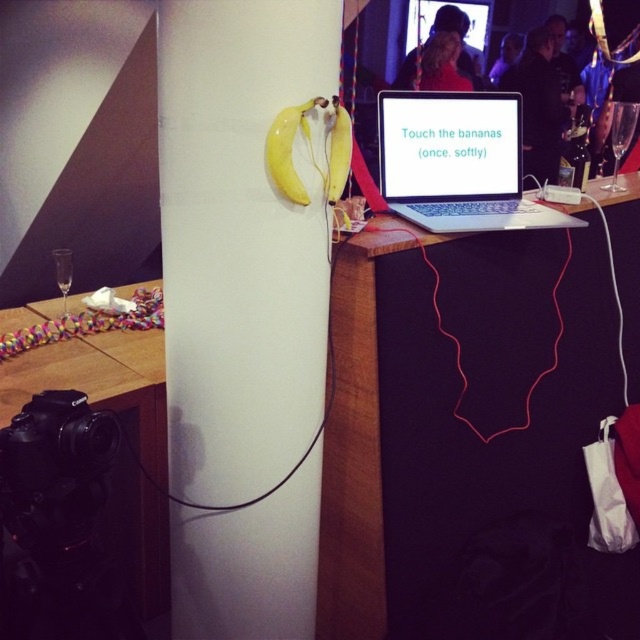
Does wooden table at center have a lesser height compared to white glossy pillar at center?

Yes.

Which of these two, wooden table at center or white glossy pillar at center, stands taller?

white glossy pillar at center is taller.

Who is more forward, (326, 458) or (166, 410)?

Positioned in front is point (166, 410).

At what (x,y) coordinates should I click in order to perform the action: click on wooden table at center. Please return your answer as a coordinate pair (x, y). Looking at the image, I should click on (454, 404).

Between white glossy pillar at center and satin silver laptop at center, which one appears on the right side from the viewer's perspective?

Positioned to the right is satin silver laptop at center.

Is point (339, 42) closer to camera compared to point (417, 157)?

Yes.

Where is `white glossy pillar at center`? This screenshot has width=640, height=640. white glossy pillar at center is located at coordinates (241, 241).

Between wooden table at center and satin silver laptop at center, which one appears on the left side from the viewer's perspective?

satin silver laptop at center

Consider the image. Can you confirm if wooden table at center is thinner than satin silver laptop at center?

No, wooden table at center is not thinner than satin silver laptop at center.

Image resolution: width=640 pixels, height=640 pixels. Find the location of `wooden table at center`. wooden table at center is located at coordinates (454, 404).

Image resolution: width=640 pixels, height=640 pixels. Find the location of `wooden table at center`. wooden table at center is located at coordinates coord(454,404).